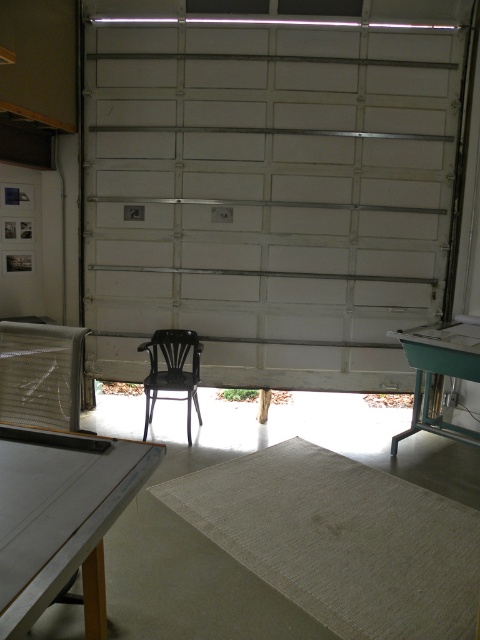
You need to place a large box that requires a sturdy surface. Which table between the white glossy table at lower left and the green plastic table at right can accommodate it better?

The green plastic table at right is larger and can accommodate the large box better since it is bigger than the white glossy table at lower left.

You are moving a small plant from the green plastic table at right to the metallic black chair at center. In which direction should you move the plant?

You should move the plant to the left, as the metallic black chair at center is to the left of the green plastic table at right.

You are standing in the garage and want to place a small object on the closest point between point [7,419] and point [167,342]. Which point should you choose?

Point [7,419] is closer to the camera than point [167,342], so you should choose point [7,419] to place the small object.